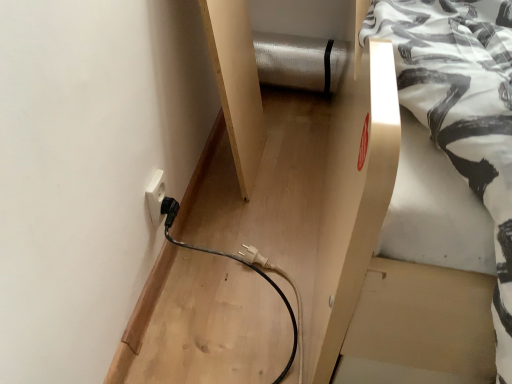
Question: Should I look upward or downward to see white plastic electric outlet at lower left?

Choices:
 (A) up
 (B) down

Answer: (B)